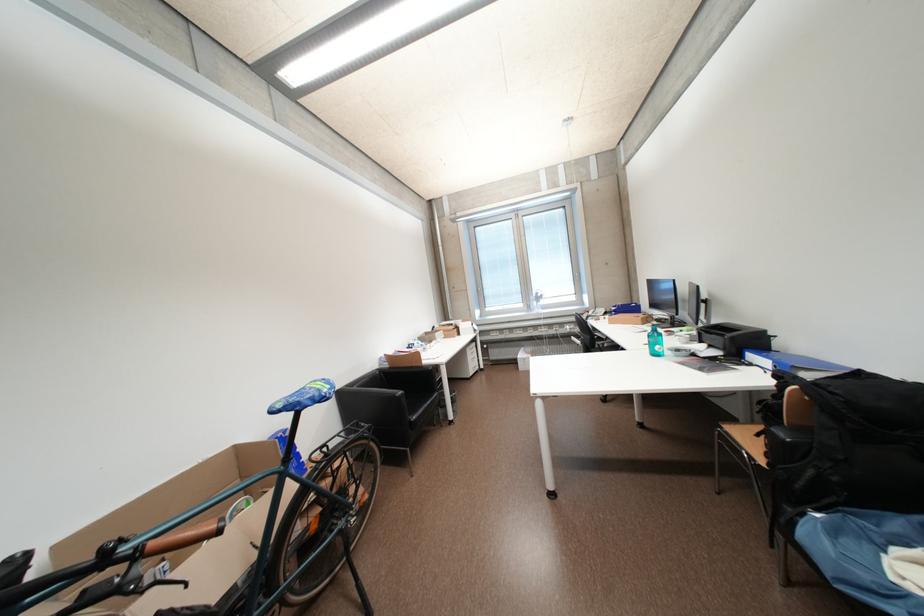
This screenshot has height=616, width=924. Find the location of `blue bicycle seat`. blue bicycle seat is located at coordinates (304, 397).